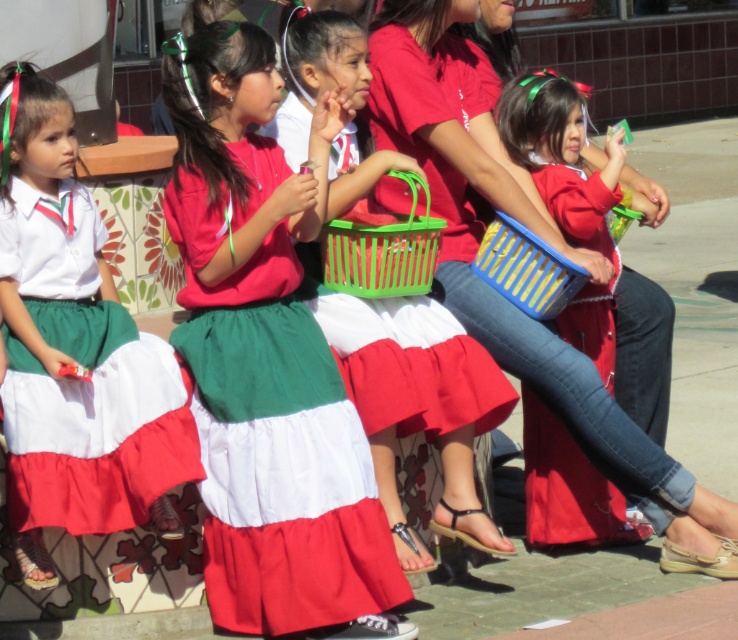
Question: Is green cotton skirt at center closer to the viewer compared to matte red skirt at center?

Choices:
 (A) yes
 (B) no

Answer: (A)

Question: Which object is positioned closest to the green cotton skirt at center?

Choices:
 (A) matte plastic basket at center
 (B) green plastic basket at center
 (C) green cotton skirt at left
 (D) blue plastic basket at center

Answer: (C)

Question: Does green cotton skirt at center appear under green cotton skirt at left?

Choices:
 (A) yes
 (B) no

Answer: (A)

Question: Which of these objects is positioned farthest from the blue plastic basket at center?

Choices:
 (A) green cotton skirt at left
 (B) matte plastic basket at center
 (C) green cotton skirt at center

Answer: (A)

Question: Is matte red skirt at center to the left of blue plastic basket at center from the viewer's perspective?

Choices:
 (A) no
 (B) yes

Answer: (A)

Question: Considering the real-world distances, which object is closest to the green cotton skirt at left?

Choices:
 (A) green cotton skirt at center
 (B) green plastic basket at center

Answer: (A)